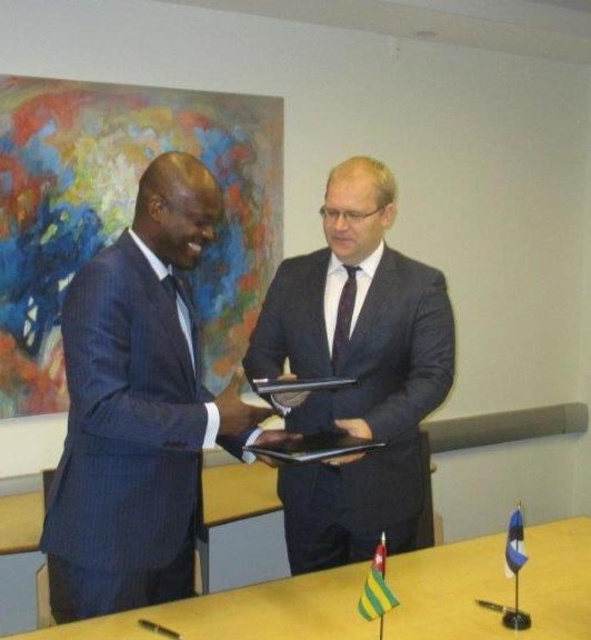
Question: Does dark blue suit at center have a lesser width compared to wooden table at center?

Choices:
 (A) no
 (B) yes

Answer: (B)

Question: Which of the following is the farthest from the observer?

Choices:
 (A) blue pinstripe suit at left
 (B) wooden table at center

Answer: (B)

Question: Does dark blue suit at center have a lesser width compared to wooden table at center?

Choices:
 (A) yes
 (B) no

Answer: (A)

Question: From the image, what is the correct spatial relationship of blue pinstripe suit at left in relation to dark blue suit at center?

Choices:
 (A) below
 (B) above

Answer: (A)

Question: Considering the real-world distances, which object is farthest from the wooden table at center?

Choices:
 (A) dark blue suit at center
 (B) blue pinstripe suit at left

Answer: (B)

Question: Which object is closer to the camera taking this photo?

Choices:
 (A) blue pinstripe suit at left
 (B) wooden table at center
 (C) dark blue suit at center

Answer: (A)